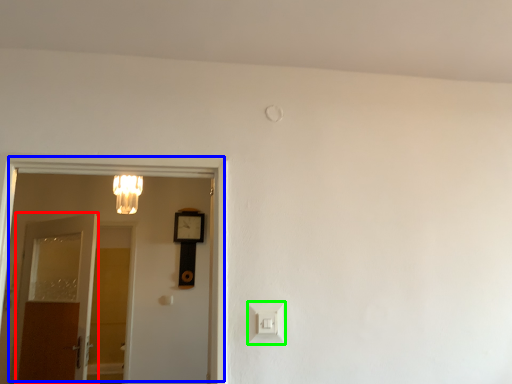
Question: Estimate the real-world distances between objects in this image. Which object is closer to door (highlighted by a red box), door (highlighted by a blue box) or light switch (highlighted by a green box)?

Choices:
 (A) door
 (B) light switch

Answer: (A)